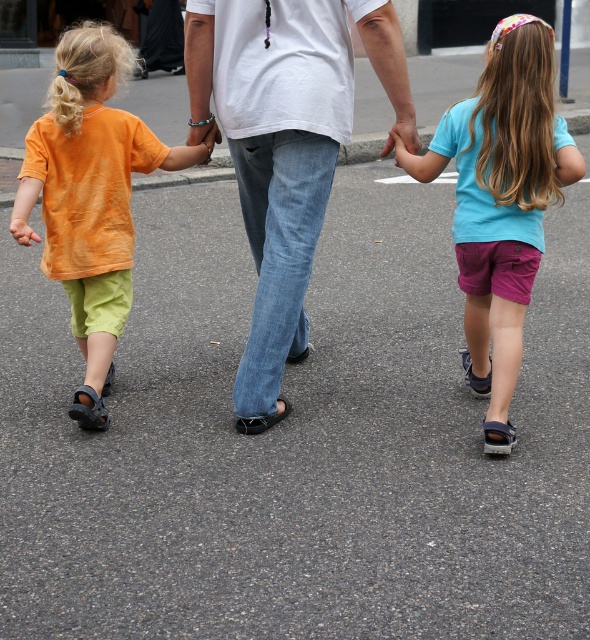
You are a delivery robot with a 1.5 meter wide package. You need to pass through the space between the orange cotton shirt at left and the matte skin hand at center. Can your package fit through this space?

The distance between the orange cotton shirt at left and the matte skin hand at center is 1.49 meters. Since the package is 1.5 meters wide, it cannot fit through the space between them.